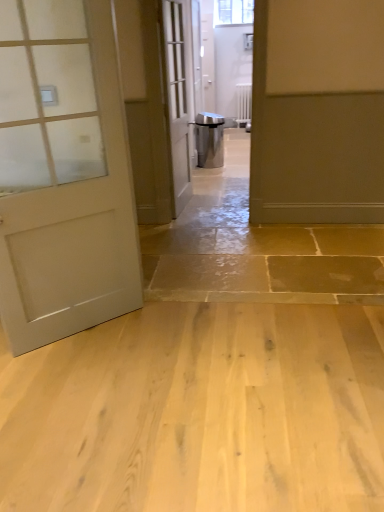
Question: Looking at the image, does light brown wood flooring at center seem bigger or smaller compared to clear glass window at upper center?

Choices:
 (A) small
 (B) big

Answer: (B)

Question: In terms of height, does light brown wood flooring at center look taller or shorter compared to clear glass window at upper center?

Choices:
 (A) short
 (B) tall

Answer: (A)

Question: Which of these objects is positioned farthest from the matte white door at left, the first door viewed from the front?

Choices:
 (A) white glass door at center, which appears as the 2th door when viewed from the left
 (B) light brown wood flooring at center
 (C) white painted metal radiator at center
 (D) matte gray door at right, which is the first door from back to front
 (E) clear glass window at upper center

Answer: (E)

Question: Which object is the farthest from the clear glass window at upper center?

Choices:
 (A) white painted metal radiator at center
 (B) matte gray door at right, which is counted as the 3th door, starting from the left
 (C) matte white door at left, the first door viewed from the front
 (D) white glass door at center, which appears as the 2th door when viewed from the left
 (E) light brown wood flooring at center

Answer: (E)